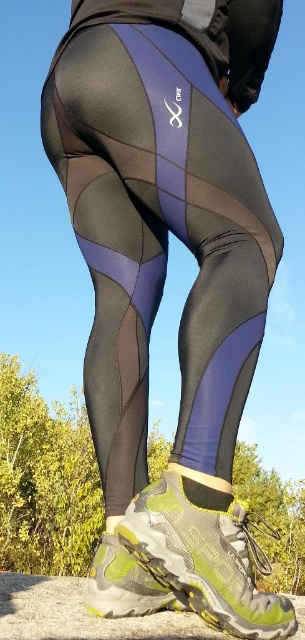
Question: Does matte black leggings at center have a smaller size compared to matte green and yellow hiking boot at lower center?

Choices:
 (A) no
 (B) yes

Answer: (A)

Question: Among these points, which one is nearest to the camera?

Choices:
 (A) (178, 545)
 (B) (118, 605)

Answer: (A)

Question: Is matte black leggings at center wider than green mesh running shoe at lower center?

Choices:
 (A) yes
 (B) no

Answer: (A)

Question: Estimate the real-world distances between objects in this image. Which object is farther from the matte green and yellow hiking boot at lower center?

Choices:
 (A) matte black leggings at center
 (B) green mesh running shoe at lower center

Answer: (A)

Question: Which of these objects is positioned closest to the matte black leggings at center?

Choices:
 (A) green mesh running shoe at lower center
 (B) matte green and yellow hiking boot at lower center

Answer: (A)

Question: Is matte black leggings at center to the left of matte green and yellow hiking boot at lower center from the viewer's perspective?

Choices:
 (A) no
 (B) yes

Answer: (A)